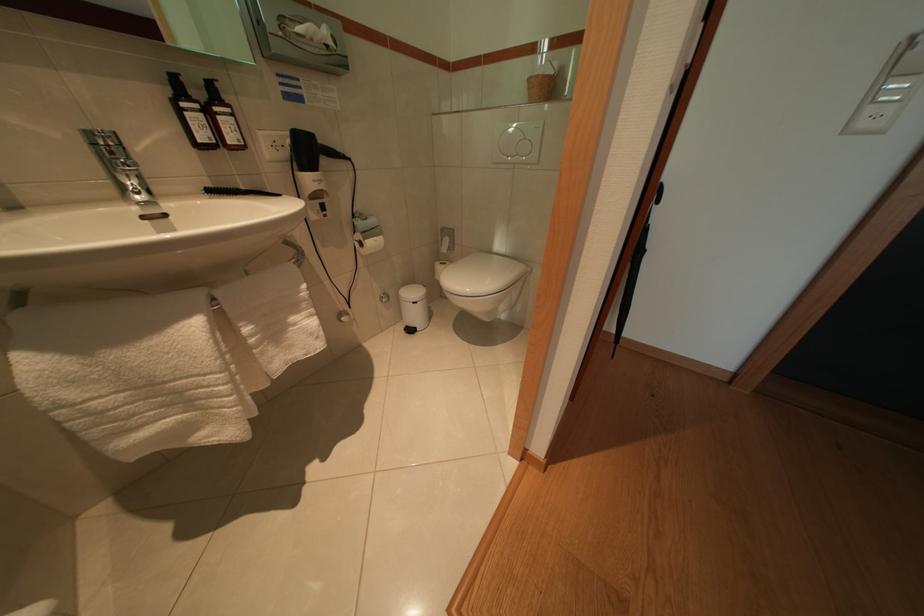
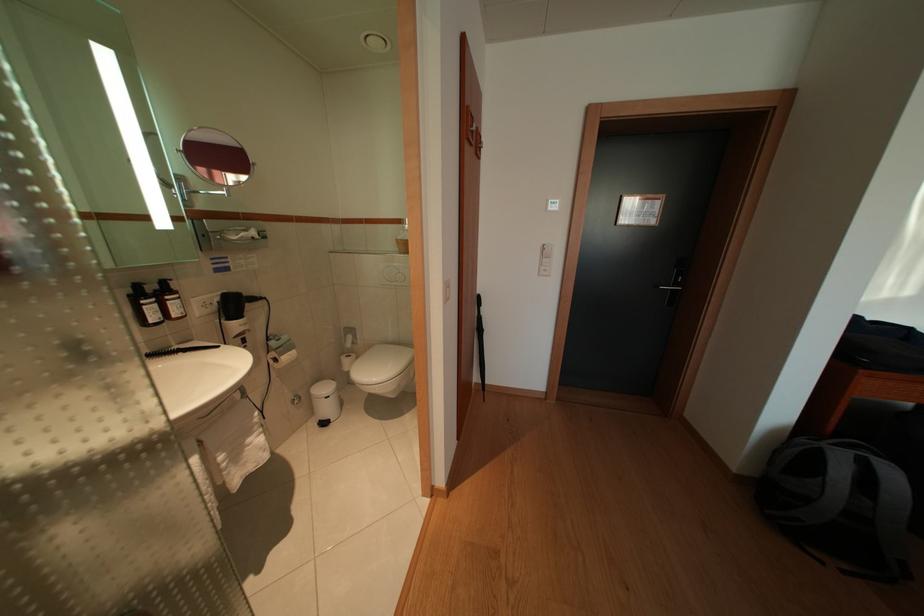
Question: Based on the continuous images, in which direction is the camera rotating? Reply with the corresponding letter.

Choices:
 (A) Left
 (B) Right
 (C) Up
 (D) Down

Answer: (B)